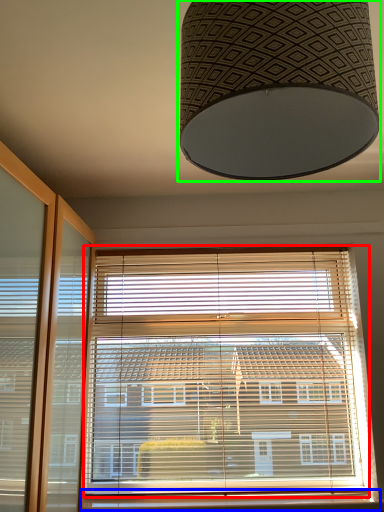
Question: Considering the real-world distances, which object is farthest from window blind (highlighted by a red box)? window sill (highlighted by a blue box) or lamp (highlighted by a green box)?

Choices:
 (A) window sill
 (B) lamp

Answer: (B)